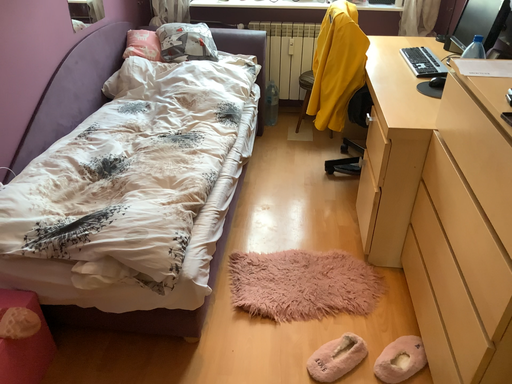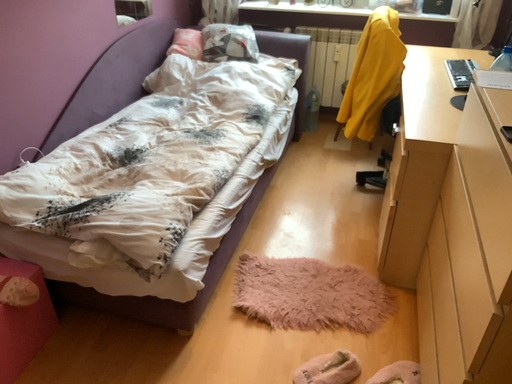
Question: How did the camera likely rotate when shooting the video?

Choices:
 (A) rotated right
 (B) rotated left

Answer: (B)